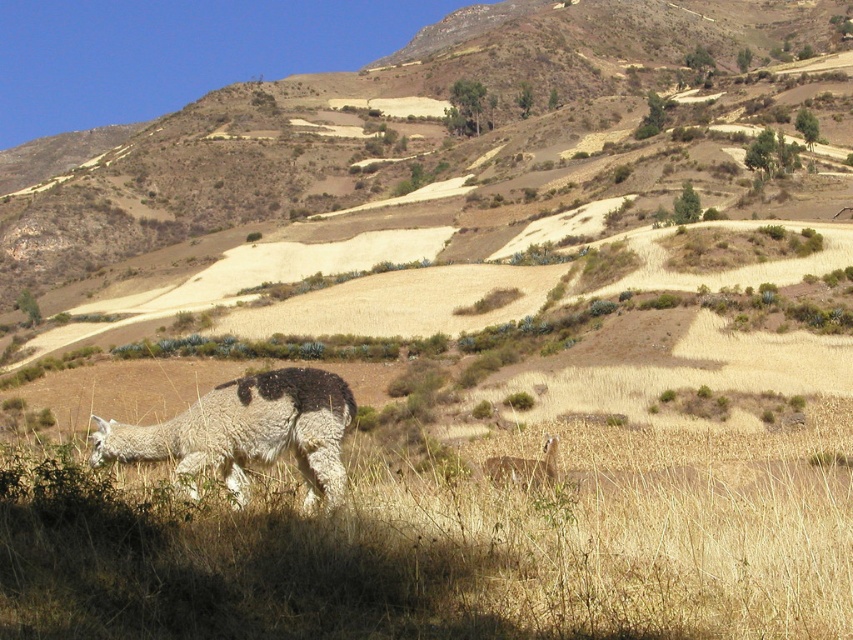
Question: Can you confirm if fuzzy white alpaca at lower left is smaller than fuzzy white alpaca at center?

Choices:
 (A) no
 (B) yes

Answer: (B)

Question: Among these objects, which one is nearest to the camera?

Choices:
 (A) fuzzy white alpaca at center
 (B) fuzzy white alpaca at lower left

Answer: (B)

Question: Does fuzzy white alpaca at lower left appear on the left side of fuzzy white alpaca at center?

Choices:
 (A) no
 (B) yes

Answer: (B)

Question: Among these points, which one is nearest to the camera?

Choices:
 (A) (309, 435)
 (B) (550, 477)

Answer: (A)

Question: Which object is farther from the camera taking this photo?

Choices:
 (A) fuzzy white alpaca at lower left
 (B) fuzzy white alpaca at center

Answer: (B)

Question: Is fuzzy white alpaca at lower left smaller than fuzzy white alpaca at center?

Choices:
 (A) yes
 (B) no

Answer: (A)